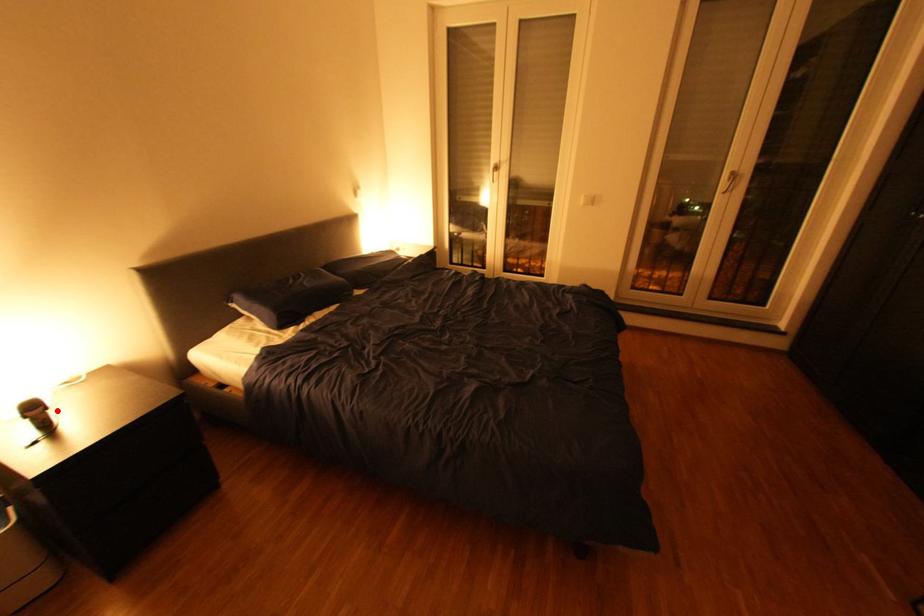
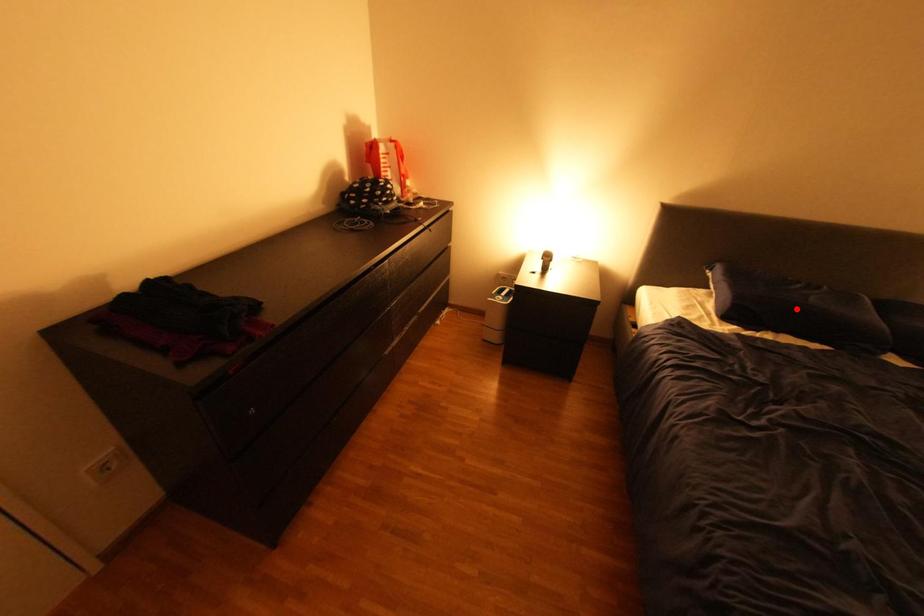
I am providing you with two images of the same scene from different viewpoints. A red point is marked on the first image and another point is marked on the second image. Are the points marked in image1 and image2 representing the same 3D position?

No